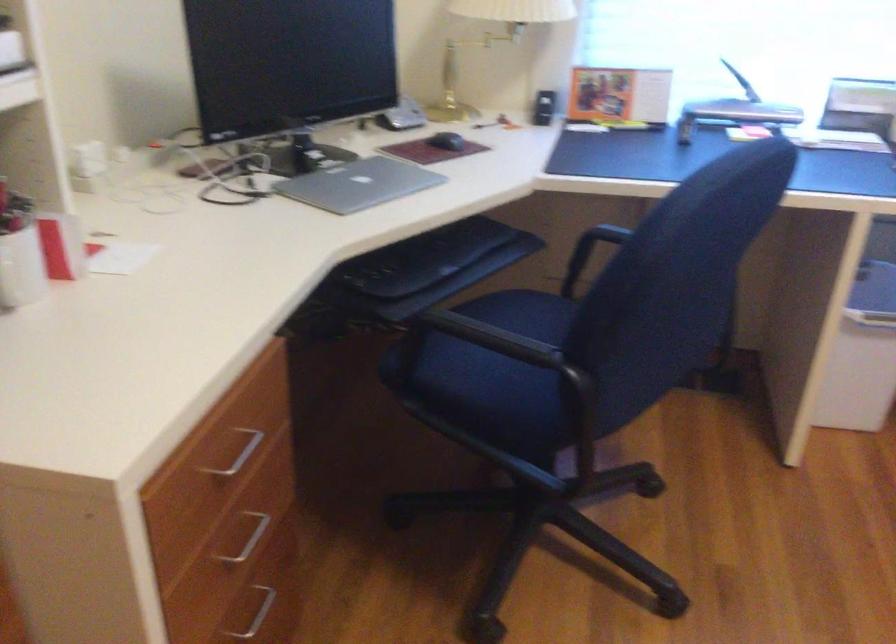
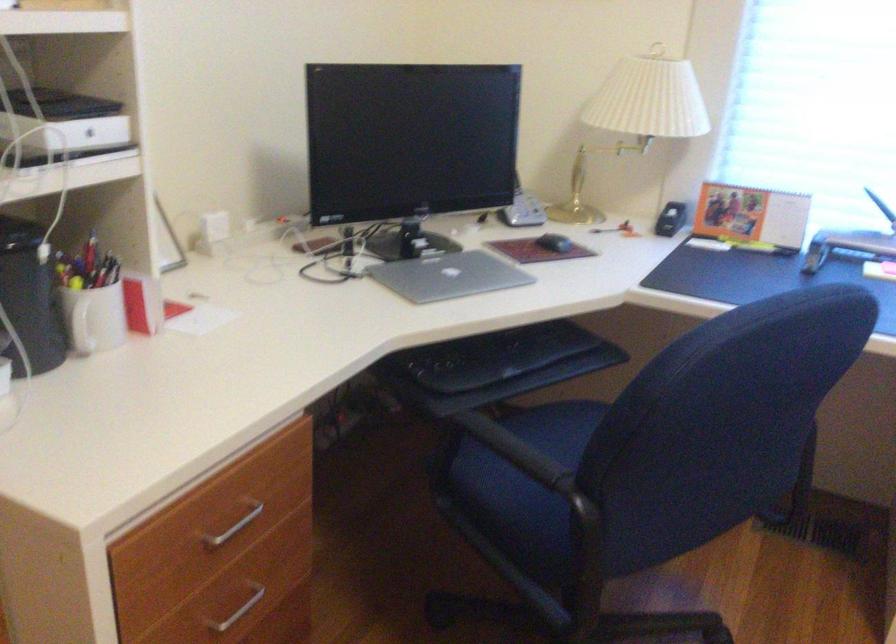
In the second image, find the point that corresponds to pixel 495 345 in the first image.

(513, 450)